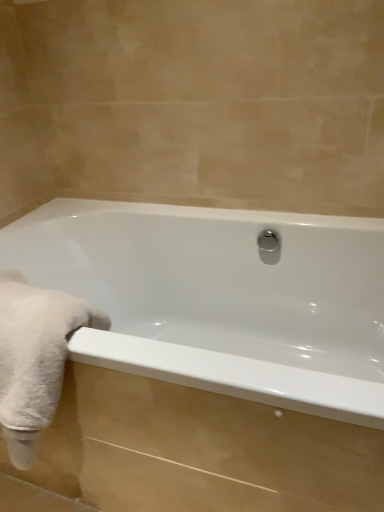
The image size is (384, 512). I want to click on white glossy bathtub at center, so click(x=220, y=298).

This screenshot has width=384, height=512. In order to click on white fluffy towel at left in this screenshot , I will do `click(34, 358)`.

What do you see at coordinates (34, 358) in the screenshot?
I see `white fluffy towel at left` at bounding box center [34, 358].

You are a GUI agent. You are given a task and a screenshot of the screen. Output one action in this format:
    pyautogui.click(x=<x>, y=<y>)
    Task: Click on the white glossy bathtub at center
    
    Given the screenshot: What is the action you would take?
    pyautogui.click(x=220, y=298)

Can you confirm if white glossy bathtub at center is positioned to the left of polished chrome shower at center?

Correct, you'll find white glossy bathtub at center to the left of polished chrome shower at center.

Considering the sizes of objects white glossy bathtub at center and polished chrome shower at center in the image provided, who is thinner, white glossy bathtub at center or polished chrome shower at center?

With smaller width is polished chrome shower at center.

Is point (271, 348) closer or farther from the camera than point (273, 246)?

Clearly, point (271, 348) is more distant from the camera than point (273, 246).

Is white glossy bathtub at center next to polished chrome shower at center?

No, white glossy bathtub at center is not with polished chrome shower at center.

From a real-world perspective, is polished chrome shower at center below white fluffy towel at left?

No.

Does polished chrome shower at center have a greater width compared to white fluffy towel at left?

No, polished chrome shower at center is not wider than white fluffy towel at left.

Is polished chrome shower at center bigger or smaller than white glossy bathtub at center?

Considering their sizes, polished chrome shower at center takes up less space than white glossy bathtub at center.

Which is correct: polished chrome shower at center is inside white glossy bathtub at center, or outside of it?

polished chrome shower at center is contained in white glossy bathtub at center.

Locate an element on the screen. The image size is (384, 512). shower above the white glossy bathtub at center (from the image's perspective) is located at coordinates [x=268, y=241].

Is white glossy bathtub at center at the back of polished chrome shower at center?

Correct, polished chrome shower at center is looking away from white glossy bathtub at center.

From the picture: Considering the sizes of objects white glossy bathtub at center and white fluffy towel at left in the image provided, who is bigger, white glossy bathtub at center or white fluffy towel at left?

With larger size is white glossy bathtub at center.

Between white glossy bathtub at center and white fluffy towel at left, which one is positioned in front?

white glossy bathtub at center is in front.

Is white fluffy towel at left at the back of white glossy bathtub at center?

No, white glossy bathtub at center is not facing the opposite direction of white fluffy towel at left.

Between white glossy bathtub at center and white fluffy towel at left, which one has more height?

white glossy bathtub at center is taller.

Does point (55, 362) lie in front of point (105, 232)?

Yes, point (55, 362) is in front of point (105, 232).

Is white fluffy towel at left bigger or smaller than white glossy bathtub at center?

Clearly, white fluffy towel at left is smaller in size than white glossy bathtub at center.

Is white fluffy towel at left closer to camera compared to white glossy bathtub at center?

No, white fluffy towel at left is further to the viewer.

Considering the positions of objects white fluffy towel at left and polished chrome shower at center in the image provided, who is more to the left, white fluffy towel at left or polished chrome shower at center?

white fluffy towel at left.

From a real-world perspective, does white fluffy towel at left sit lower than polished chrome shower at center?

Yes, from a real-world perspective, white fluffy towel at left is below polished chrome shower at center.

Is white fluffy towel at left looking in the opposite direction of polished chrome shower at center?

No, white fluffy towel at left is not facing the opposite direction of polished chrome shower at center.

Locate an element on the screen. The height and width of the screenshot is (512, 384). bath towel below the polished chrome shower at center (from a real-world perspective) is located at coordinates (34, 358).

Identify the location of shower that is on the right side of white glossy bathtub at center. This screenshot has width=384, height=512. (268, 241).

In order to click on shower that appears above the white fluffy towel at left (from a real-world perspective) in this screenshot , I will do `click(268, 241)`.

Considering their positions, is white glossy bathtub at center positioned closer to white fluffy towel at left than polished chrome shower at center?

white glossy bathtub at center is positioned closer to the anchor white fluffy towel at left.

Consider the image. Which object lies nearer to the anchor point white glossy bathtub at center, white fluffy towel at left or polished chrome shower at center?

polished chrome shower at center is positioned closer to the anchor white glossy bathtub at center.

Estimate the real-world distances between objects in this image. Which object is closer to white glossy bathtub at center, polished chrome shower at center or white fluffy towel at left?

polished chrome shower at center is closer to white glossy bathtub at center.

Which object lies nearer to the anchor point polished chrome shower at center, white glossy bathtub at center or white fluffy towel at left?

Among the two, white glossy bathtub at center is located nearer to polished chrome shower at center.

Which object lies nearer to the anchor point polished chrome shower at center, white fluffy towel at left or white glossy bathtub at center?

white glossy bathtub at center is closer to polished chrome shower at center.

Considering their positions, is polished chrome shower at center positioned further to white fluffy towel at left than white glossy bathtub at center?

The object further to white fluffy towel at left is polished chrome shower at center.

Where is `bath towel positioned between white glossy bathtub at center and polished chrome shower at center from near to far`? bath towel positioned between white glossy bathtub at center and polished chrome shower at center from near to far is located at coordinates (34, 358).